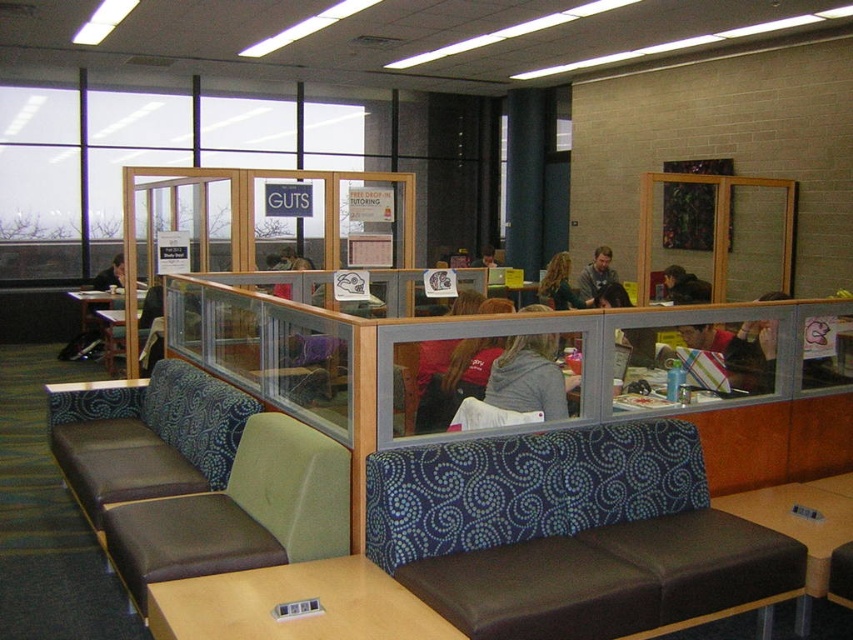
You are sitting on the brown leather bench at center and want to place your phone on the smooth brown table at lower right. Can you reach it without moving from your seat?

The brown leather bench at center is in front of the smooth brown table at lower right, so you can reach the smooth brown table at lower right from your current position on the brown leather bench at center without needing to move.

You are a photographer taking a portrait of someone sitting at the table. You need to adjust the lighting to ensure both the gray sweater at center and the blonde hair at center are well illuminated. Which object should you focus the light on first, the one closer to the camera or the one further away?

The gray sweater at center is located below blonde hair at center, so the blonde hair at center is closer to the camera. Therefore, you should focus the light on the blonde hair at center first to ensure proper illumination before adjusting for the gray sweater at center.

You are standing in the study area and want to reach a specific point marked at coordinates point [527,406]. If you can move forward 10 feet, will you be able to reach that point?

The point [527,406] is 10.75 feet away from you. Since you can only move forward 10 feet, you will not be able to reach the point as it is slightly farther than your movement limit.